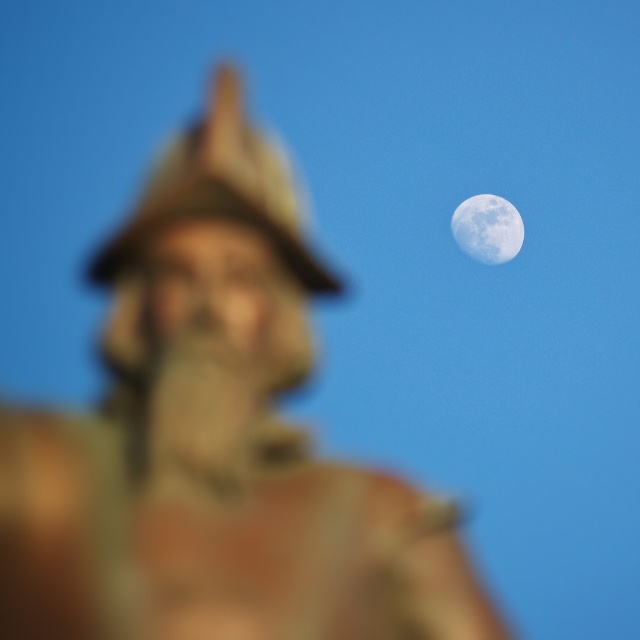
You are a photographer who wants to capture the matte stone statue at upper right and the smooth white moon at upper right in a single shot. Based on the scene, which object is closer to the camera?

The matte stone statue at upper right is in front of the smooth white moon at upper right, so the statue is closer to the camera than the moon.

You are an astronomer analyzing the image. You notice the matte stone statue at upper right and the smooth white moon at upper right. Based on their sizes in the image, which object would appear closer to the camera?

The matte stone statue at upper right is not as tall as the smooth white moon at upper right, so the moon is larger in the image and thus appears closer to the camera.